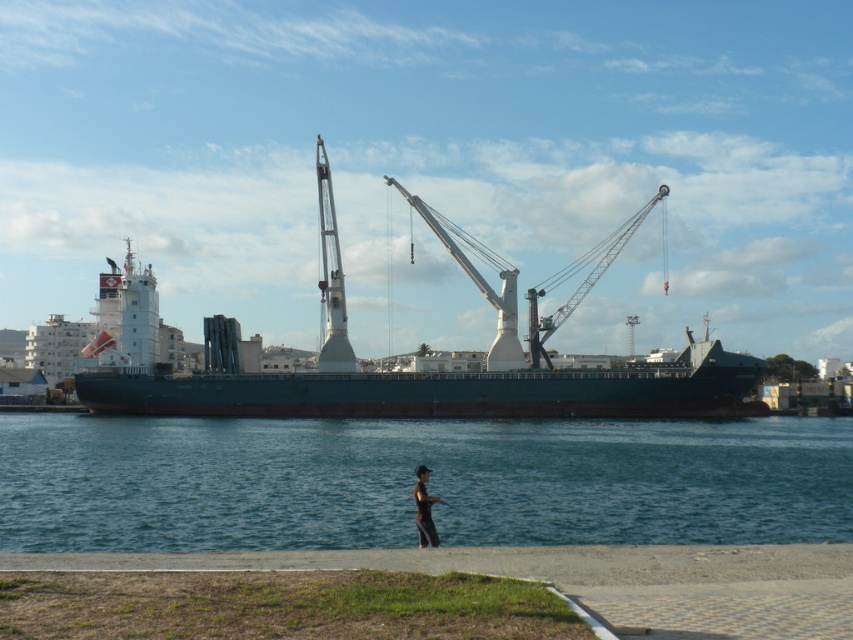
Question: Does metallic gray crane at center have a larger size compared to black fabric person at lower center?

Choices:
 (A) yes
 (B) no

Answer: (A)

Question: Is clear blue water at center to the left of black fabric person at lower center from the viewer's perspective?

Choices:
 (A) yes
 (B) no

Answer: (A)

Question: Estimate the real-world distances between objects in this image. Which object is closer to the black fabric person at lower center?

Choices:
 (A) green matte ship at center
 (B) clear blue water at center

Answer: (B)

Question: Considering the real-world distances, which object is closest to the clear blue water at center?

Choices:
 (A) black fabric person at lower center
 (B) metallic gray crane at center

Answer: (A)

Question: Estimate the real-world distances between objects in this image. Which object is farther from the metallic gray crane at center?

Choices:
 (A) clear blue water at center
 (B) black fabric person at lower center
 (C) green matte ship at center

Answer: (B)

Question: From the image, what is the correct spatial relationship of clear blue water at center in relation to green matte ship at center?

Choices:
 (A) below
 (B) above

Answer: (A)